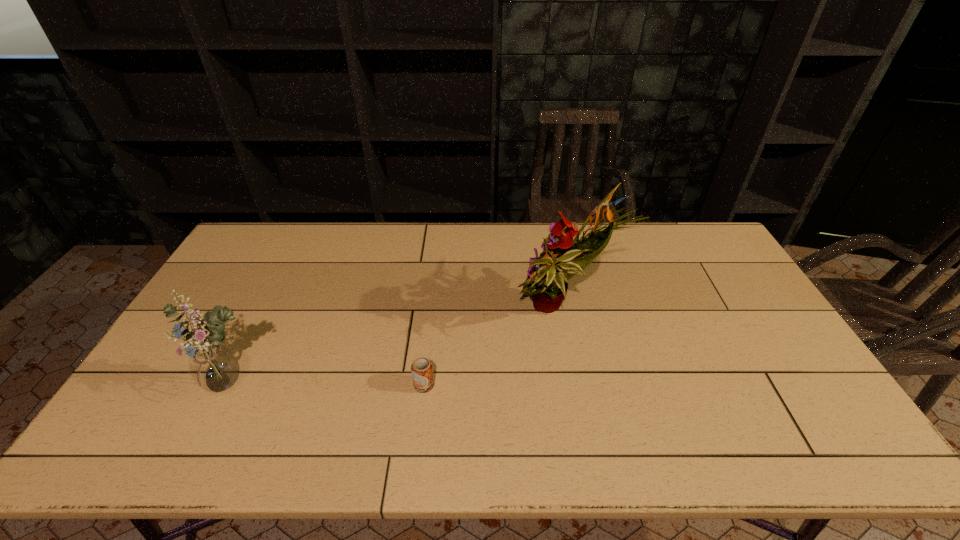
The width and height of the screenshot is (960, 540). I want to click on vacant area that satisfies the following two spatial constraints: 1. on the front-facing side of the second object from right to left; 2. on the left side of the left bouquet, so click(x=232, y=385).

Find the location of a particular element. vacant area in the image that satisfies the following two spatial constraints: 1. on the front-facing side of the right bouquet; 2. on the front-facing side of the left bouquet is located at coordinates (577, 385).

At what (x,y) coordinates should I click in order to perform the action: click on vacant area in the image that satisfies the following two spatial constraints: 1. on the front-facing side of the rightmost object; 2. on the front-facing side of the shorter bouquet. Please return your answer as a coordinate pair (x, y). The width and height of the screenshot is (960, 540). Looking at the image, I should click on (577, 385).

Locate an element on the screen. free spot that satisfies the following two spatial constraints: 1. on the front-facing side of the farther bouquet; 2. on the front-facing side of the second shortest object is located at coordinates (577, 385).